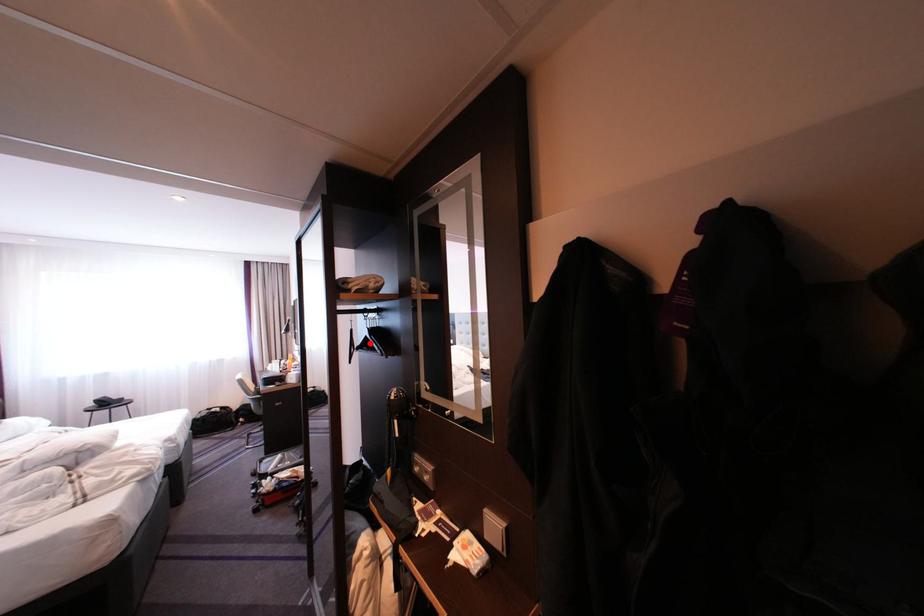
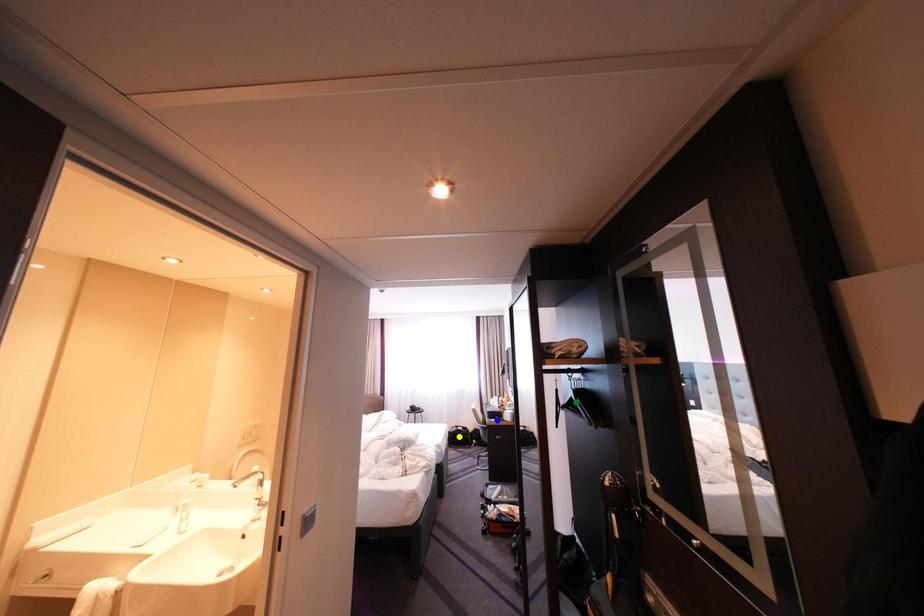
Question: I am providing you with two images of the same scene from different viewpoints. A red point is marked on the first image. You are given multiple points on the second image. Which point in image 2 represents the same 3d spot as the red point in image 1?

Choices:
 (A) green point
 (B) blue point
 (C) yellow point

Answer: (A)